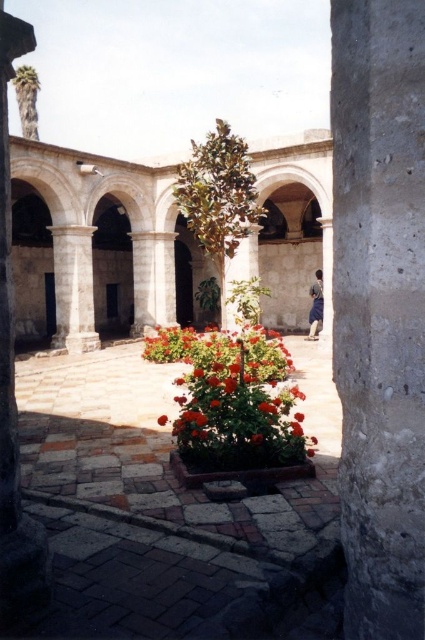
You are standing in the courtyard and want to take a photo of the smooth stone pillar at left. Where should you position yourself to capture it in the frame?

To capture the smooth stone pillar at left in the frame, position yourself at the coordinates corresponding to its 2D location at point (14,387).

You are standing in the courtyard and want to take a photo of the brown fabric person at center without including the smooth stone pillar at left in the frame. Is it possible to do so by moving to the right side of the courtyard?

The smooth stone pillar at left is positioned under the brown fabric person at center, meaning the pillar is directly beneath them. Moving to the right side of the courtyard would still keep the pillar in the background behind the person, so it might still appear in the photo. To avoid the pillar, you might need to move to the left side instead, where the pillar is not obstructing the view of the person.